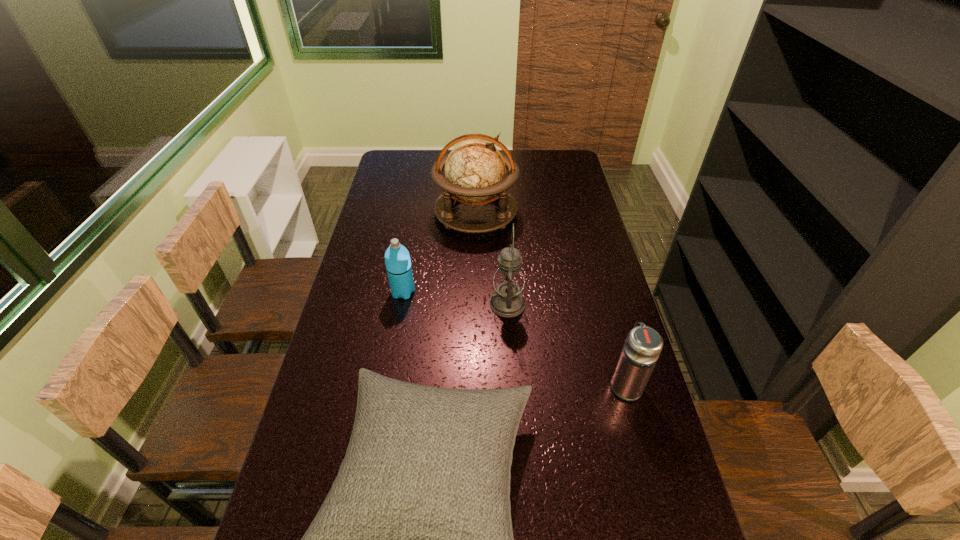
Identify the location of the farthest object. Image resolution: width=960 pixels, height=540 pixels. (475, 170).

Where is `oil lamp`? This screenshot has height=540, width=960. oil lamp is located at coordinates (507, 301).

Identify the location of the nearer thermos bottle. The width and height of the screenshot is (960, 540). (643, 345).

I want to click on the rightmost object, so click(x=643, y=345).

Where is `the left thermos bottle`? the left thermos bottle is located at coordinates pos(397,259).

You are a GUI agent. You are given a task and a screenshot of the screen. Output one action in this format:
    pyautogui.click(x=<x>, y=<y>)
    Task: Click on the vacant area situated on the front of the farthest object
    
    Given the screenshot: What is the action you would take?
    pyautogui.click(x=475, y=264)

Find the location of a particular element. This screenshot has height=540, width=960. vacant space located 0.130m on the front of the oil lamp is located at coordinates (511, 355).

You are a GUI agent. You are given a task and a screenshot of the screen. Output one action in this format:
    pyautogui.click(x=<x>, y=<y>)
    Task: Click on the vacant position located 0.300m with a handle on the side of the right thermos bottle
    
    Given the screenshot: What is the action you would take?
    pyautogui.click(x=599, y=289)

Where is `vacant position located with a handle on the side of the right thermos bottle`? This screenshot has width=960, height=540. vacant position located with a handle on the side of the right thermos bottle is located at coordinates (595, 272).

Locate an element on the screen. The width and height of the screenshot is (960, 540). free space located 0.110m with a handle on the side of the right thermos bottle is located at coordinates (612, 336).